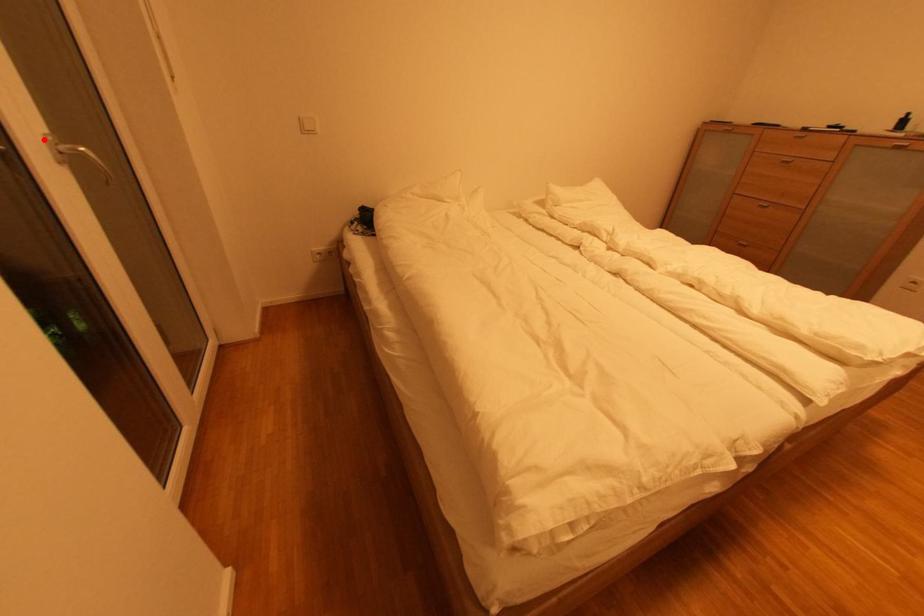
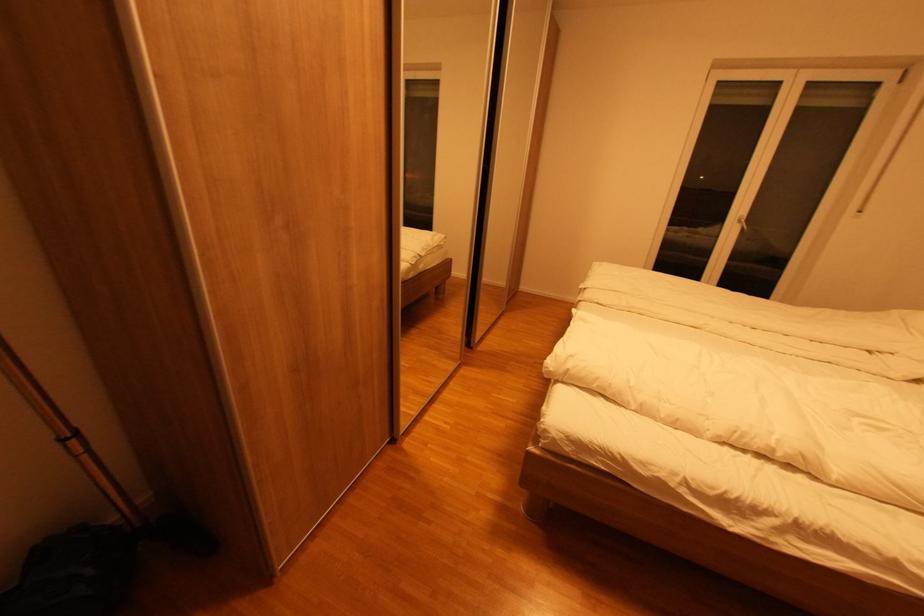
Question: I am providing you with two images of the same scene from different viewpoints. A red point is shown in image1. For the corresponding object point in image2, is it positioned nearer or farther from the camera?

Choices:
 (A) Nearer
 (B) Farther

Answer: (A)